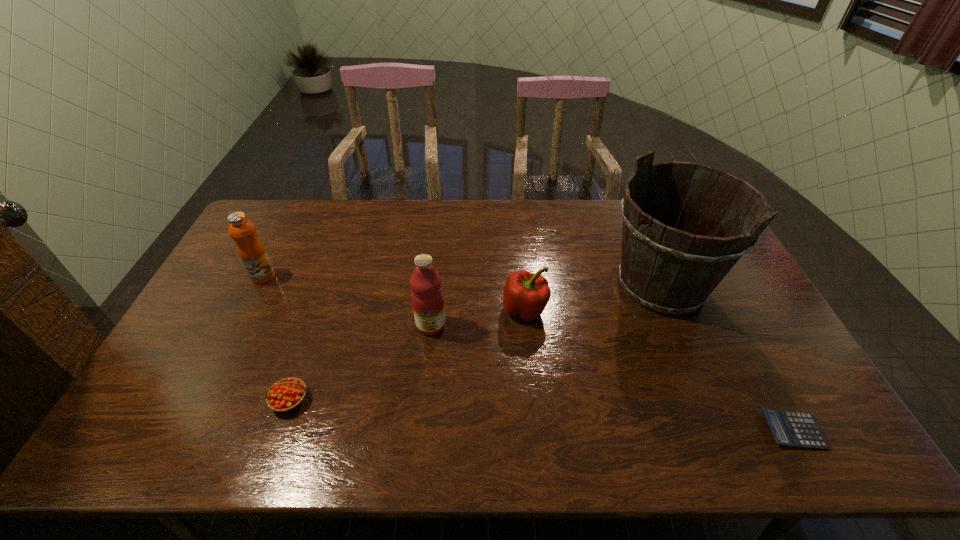
The image size is (960, 540). In order to click on free spot located on the front of the bucket in this screenshot , I will do `click(700, 380)`.

Image resolution: width=960 pixels, height=540 pixels. Find the location of `vacant area situated on the label of the nearer fruit juice`. vacant area situated on the label of the nearer fruit juice is located at coordinates (424, 390).

Locate an element on the screen. This screenshot has width=960, height=540. free space located on the back of the left fruit juice is located at coordinates (294, 218).

Identify the location of vacant region located on the right of the third object from right to left. The width and height of the screenshot is (960, 540). click(644, 309).

The image size is (960, 540). What are the coordinates of `free region located on the back of the second shortest object` in the screenshot? It's located at (329, 285).

Image resolution: width=960 pixels, height=540 pixels. I want to click on free spot located 0.090m on the back of the shortest object, so click(765, 380).

You are a GUI agent. You are given a task and a screenshot of the screen. Output one action in this format:
    pyautogui.click(x=<x>, y=<y>)
    Task: Click on the object situated at the near edge
    The width and height of the screenshot is (960, 540).
    Given the screenshot: What is the action you would take?
    pyautogui.click(x=790, y=428)

The width and height of the screenshot is (960, 540). What are the coordinates of `object positioned at the left edge` in the screenshot? It's located at click(x=252, y=252).

This screenshot has height=540, width=960. Identify the location of bucket that is at the right edge. (668, 266).

Locate an element on the screen. This screenshot has width=960, height=540. calculator that is at the right edge is located at coordinates (790, 428).